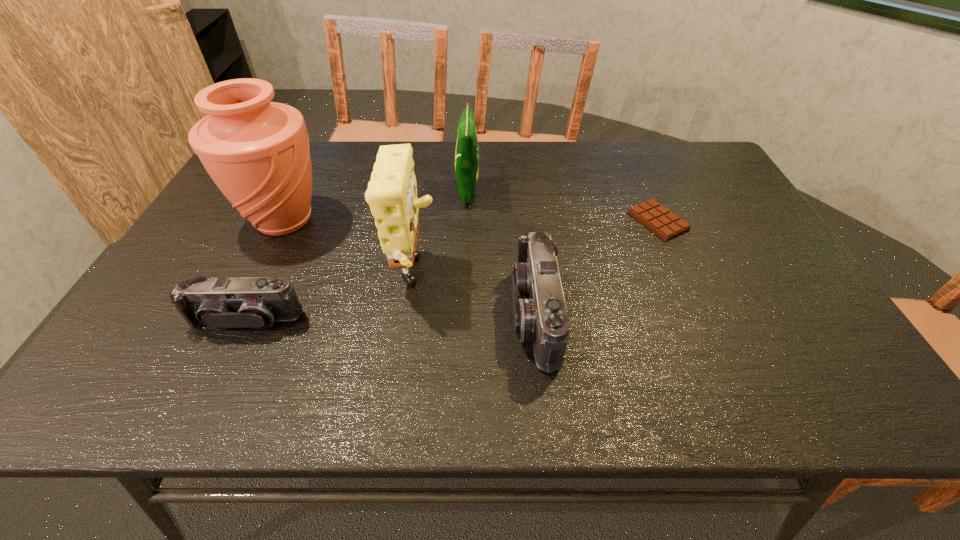
What are the coordinates of `blank region between the left camcorder and the shortest object` in the screenshot? It's located at (452, 271).

Locate an element on the screen. This screenshot has height=540, width=960. free spot between the right camcorder and the fifth shortest object is located at coordinates (475, 298).

Where is `free space between the tallest object and the second shortest object`? This screenshot has height=540, width=960. free space between the tallest object and the second shortest object is located at coordinates (265, 270).

This screenshot has height=540, width=960. I want to click on free spot between the candy bar and the second shortest object, so click(x=452, y=271).

Where is `free area in between the fifth shortest object and the crisp (potato chip)`? Image resolution: width=960 pixels, height=540 pixels. free area in between the fifth shortest object and the crisp (potato chip) is located at coordinates (441, 236).

Where is `free space between the third object from left to right and the taller camcorder`? The image size is (960, 540). free space between the third object from left to right and the taller camcorder is located at coordinates (475, 298).

Where is `free area in between the candy bar and the tallest object`? This screenshot has width=960, height=540. free area in between the candy bar and the tallest object is located at coordinates (471, 221).

Identify the location of object that can be found as the second closest to the left camcorder. The width and height of the screenshot is (960, 540). (257, 152).

I want to click on object that ranks as the closest to the vase, so click(x=219, y=303).

The height and width of the screenshot is (540, 960). I want to click on vacant region that satisfies the following two spatial constraints: 1. on the front-facing side of the crisp (potato chip); 2. on the front-facing side of the left camcorder, so click(x=464, y=320).